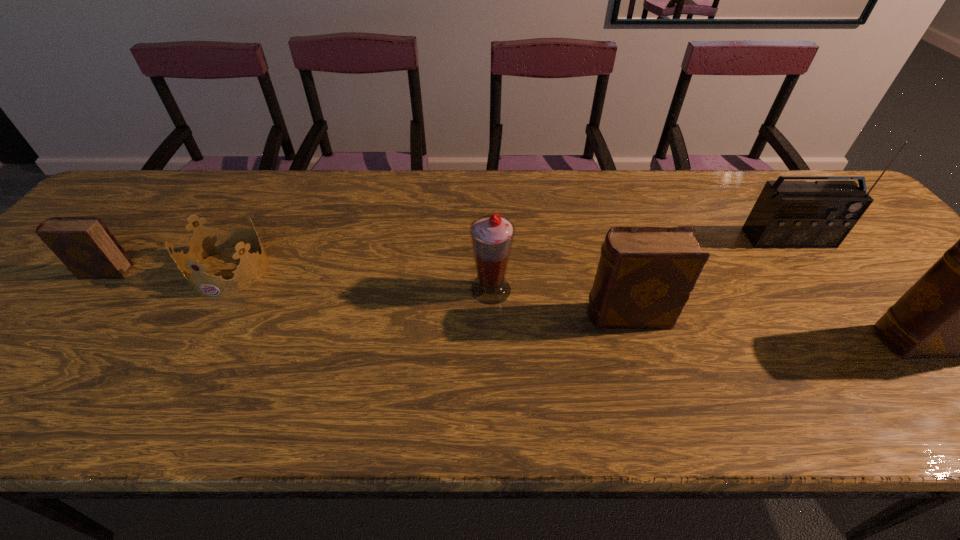
In the image, there is a desktop. Identify the location of free space at the left edge. (86, 293).

In the image, there is a desktop. Identify the location of blank space at the right edge. The image size is (960, 540). (858, 244).

In the image, there is a desktop. Where is `free region at the far right corner`? The width and height of the screenshot is (960, 540). free region at the far right corner is located at coordinates (778, 170).

Locate an element on the screen. unoccupied area between the second tallest diary and the radio receiver is located at coordinates (708, 277).

What are the coordinates of `vacant space that is in between the shortest object and the second shortest object` in the screenshot? It's located at (167, 271).

Identify the location of empty space that is in between the shortest diary and the radio receiver. (446, 255).

Where is `empty location between the leftmost diary and the tallest object`? This screenshot has width=960, height=540. empty location between the leftmost diary and the tallest object is located at coordinates (446, 255).

Find the location of a particular element. The width and height of the screenshot is (960, 540). vacant area that lies between the tallest object and the second diary from left to right is located at coordinates (708, 277).

Choose which object is the nearest neighbor to the tallest object. Please provide its 2D coordinates. Your answer should be formatted as a tuple, i.e. [(x, y)], where the tuple contains the x and y coordinates of a point satisfying the conditions above.

[(959, 308)]

Locate an element on the screen. object that stands as the second closest to the leftmost object is located at coordinates (492, 236).